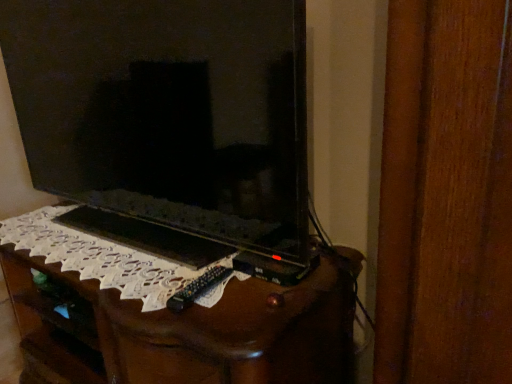
Locate an element on the screen. free space below matte black tv at center (from a real-world perspective) is located at coordinates (125, 230).